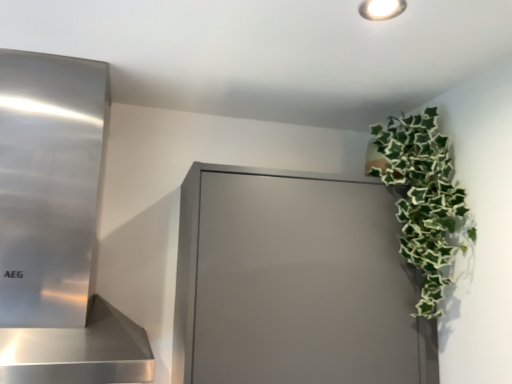
Question: Is polished stainless steel range hood at left closer to the viewer compared to green leafy plant at upper right?

Choices:
 (A) yes
 (B) no

Answer: (A)

Question: Is polished stainless steel range hood at left with green leafy plant at upper right?

Choices:
 (A) yes
 (B) no

Answer: (B)

Question: Is polished stainless steel range hood at left facing away from green leafy plant at upper right?

Choices:
 (A) no
 (B) yes

Answer: (A)

Question: Does polished stainless steel range hood at left lie behind green leafy plant at upper right?

Choices:
 (A) no
 (B) yes

Answer: (A)

Question: Are polished stainless steel range hood at left and green leafy plant at upper right located far from each other?

Choices:
 (A) yes
 (B) no

Answer: (B)

Question: In terms of size, does green leafy plant at upper right appear bigger or smaller than polished stainless steel range hood at left?

Choices:
 (A) big
 (B) small

Answer: (B)

Question: Considering the relative positions of green leafy plant at upper right and polished stainless steel range hood at left in the image provided, is green leafy plant at upper right to the left or to the right of polished stainless steel range hood at left?

Choices:
 (A) left
 (B) right

Answer: (B)

Question: Does point (418, 200) appear closer or farther from the camera than point (45, 163)?

Choices:
 (A) farther
 (B) closer

Answer: (A)

Question: In terms of height, does green leafy plant at upper right look taller or shorter compared to polished stainless steel range hood at left?

Choices:
 (A) tall
 (B) short

Answer: (B)

Question: In terms of height, does polished stainless steel range hood at left look taller or shorter compared to matte gray cabinet at upper right?

Choices:
 (A) tall
 (B) short

Answer: (A)

Question: From a real-world perspective, is polished stainless steel range hood at left positioned above or below matte gray cabinet at upper right?

Choices:
 (A) below
 (B) above

Answer: (B)

Question: Looking at the image, does polished stainless steel range hood at left seem bigger or smaller compared to matte gray cabinet at upper right?

Choices:
 (A) small
 (B) big

Answer: (B)

Question: Visually, is polished stainless steel range hood at left positioned to the left or to the right of matte gray cabinet at upper right?

Choices:
 (A) right
 (B) left

Answer: (B)

Question: Based on their sizes in the image, would you say matte gray cabinet at upper right is bigger or smaller than polished stainless steel range hood at left?

Choices:
 (A) big
 (B) small

Answer: (B)

Question: Is point (334, 248) closer or farther from the camera than point (16, 316)?

Choices:
 (A) farther
 (B) closer

Answer: (A)